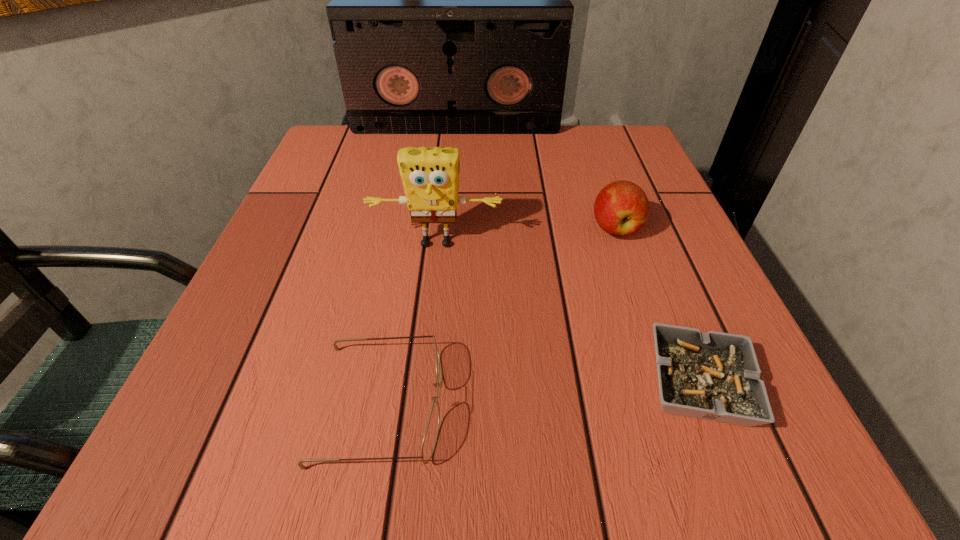
The width and height of the screenshot is (960, 540). Identify the location of free space at the left edge. (344, 294).

The image size is (960, 540). Identify the location of free space at the right edge of the desktop. (651, 218).

Where is `free point at the far right corner`? The height and width of the screenshot is (540, 960). free point at the far right corner is located at coordinates (632, 152).

Locate an element on the screen. The width and height of the screenshot is (960, 540). free space at the near right corner of the desktop is located at coordinates (759, 431).

In order to click on free spot between the videotape and the apple in this screenshot , I will do `click(536, 179)`.

At what (x,y) coordinates should I click in order to perform the action: click on free space that is in between the apple and the second tallest object. Please return your answer as a coordinate pair (x, y). The width and height of the screenshot is (960, 540). Looking at the image, I should click on (525, 236).

Locate an element on the screen. This screenshot has height=540, width=960. empty space between the second tallest object and the third shortest object is located at coordinates (525, 236).

Identify the location of free space between the fourth tallest object and the second tallest object. point(409,324).

The height and width of the screenshot is (540, 960). In order to click on vacant area that lies between the sponge and the ashtray in this screenshot , I will do `click(567, 314)`.

Where is `free spot between the fourth shortest object and the third tallest object`? free spot between the fourth shortest object and the third tallest object is located at coordinates (525, 236).